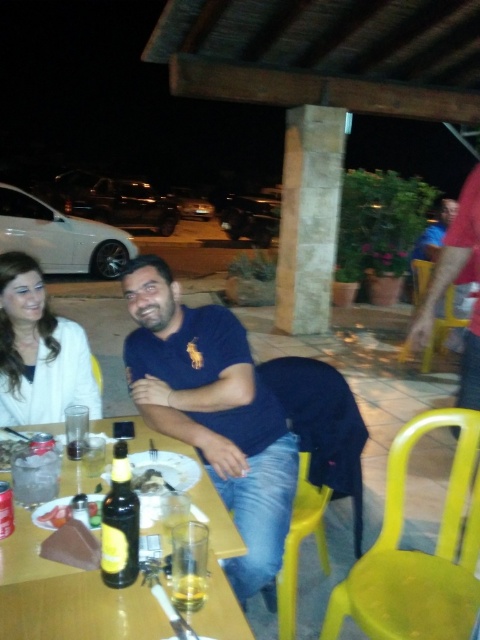
Is matte blue polo shirt at center wider than wooden table at center?

In fact, matte blue polo shirt at center might be narrower than wooden table at center.

Which is below, matte blue polo shirt at center or wooden table at center?

wooden table at center is below.

Identify the location of matte blue polo shirt at center. (213, 412).

Locate an element on the screen. matte blue polo shirt at center is located at coordinates (213, 412).

Does point (115, 541) come behind point (179, 604)?

That is False.

Is amber glass bottle at table center to the left of translucent glass at table center from the viewer's perspective?

Indeed, amber glass bottle at table center is positioned on the left side of translucent glass at table center.

Does point (124, 497) come closer to viewer compared to point (188, 602)?

No, it is behind (188, 602).

You are a GUI agent. You are given a task and a screenshot of the screen. Output one action in this format:
    pyautogui.click(x=<x>, y=<y>)
    Task: Click on the amber glass bottle at table center
    
    Given the screenshot: What is the action you would take?
    pyautogui.click(x=120, y=524)

Can you confirm if wooden table at center is taller than smooth white cheese at center?

Correct, wooden table at center is much taller as smooth white cheese at center.

Does wooden table at center have a smaller size compared to smooth white cheese at center?

Actually, wooden table at center might be larger than smooth white cheese at center.

The height and width of the screenshot is (640, 480). I want to click on wooden table at center, so click(66, 596).